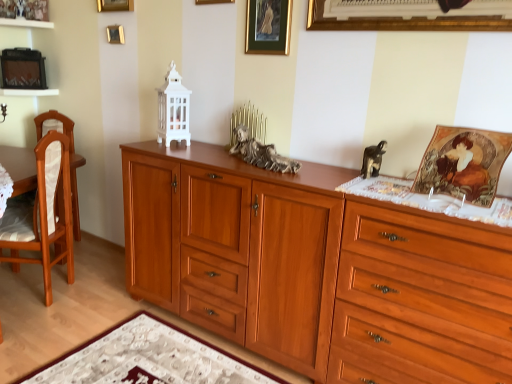
Question: Does wooden cabinet at center appear on the right side of white textured mat at lower center?

Choices:
 (A) no
 (B) yes

Answer: (B)

Question: Could you tell me if wooden cabinet at center is facing white textured mat at lower center?

Choices:
 (A) yes
 (B) no

Answer: (A)

Question: From the image's perspective, is wooden cabinet at center beneath white textured mat at lower center?

Choices:
 (A) no
 (B) yes

Answer: (A)

Question: Is wooden cabinet at center thinner than white textured mat at lower center?

Choices:
 (A) yes
 (B) no

Answer: (A)

Question: From a real-world perspective, is wooden cabinet at center located beneath white textured mat at lower center?

Choices:
 (A) no
 (B) yes

Answer: (A)

Question: In the image, is light brown wood chair at left on the left side or the right side of white textured mat at lower center?

Choices:
 (A) right
 (B) left

Answer: (B)

Question: From a real-world perspective, relative to white textured mat at lower center, is light brown wood chair at left vertically above or below?

Choices:
 (A) above
 (B) below

Answer: (A)

Question: Is light brown wood chair at left taller or shorter than white textured mat at lower center?

Choices:
 (A) tall
 (B) short

Answer: (A)

Question: In terms of width, does light brown wood chair at left look wider or thinner when compared to white textured mat at lower center?

Choices:
 (A) wide
 (B) thin

Answer: (B)

Question: From a real-world perspective, relative to gold metallic picture frame at upper left, placed as the 1th picture frame when sorted from left to right, is matte gold picture frame at upper right, which ranks as the first picture frame in bottom-to-top order, vertically above or below?

Choices:
 (A) above
 (B) below

Answer: (B)

Question: Is matte gold picture frame at upper right, which is counted as the fifth picture frame, starting from the left, taller or shorter than gold metallic picture frame at upper left, placed as the third picture frame when sorted from top to bottom?

Choices:
 (A) tall
 (B) short

Answer: (A)

Question: Is matte gold picture frame at upper right, positioned as the 5th picture frame in top-to-bottom order, in front of or behind gold metallic picture frame at upper left, the 1th picture frame viewed from the back, in the image?

Choices:
 (A) front
 (B) behind

Answer: (A)

Question: Visually, is matte gold picture frame at upper right, marked as the 5th picture frame in a back-to-front arrangement, positioned to the left or to the right of gold metallic picture frame at upper left, the 1th picture frame viewed from the back?

Choices:
 (A) right
 (B) left

Answer: (A)

Question: From the image's perspective, relative to bronze statue at center, the second animal in the right-to-left sequence, is white textured mat at lower center above or below?

Choices:
 (A) below
 (B) above

Answer: (A)

Question: In terms of height, does white textured mat at lower center look taller or shorter compared to bronze statue at center, the second animal in the right-to-left sequence?

Choices:
 (A) tall
 (B) short

Answer: (B)